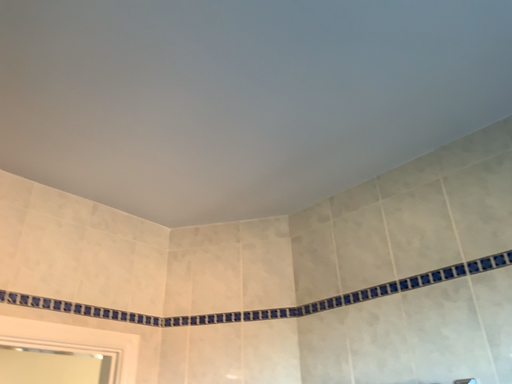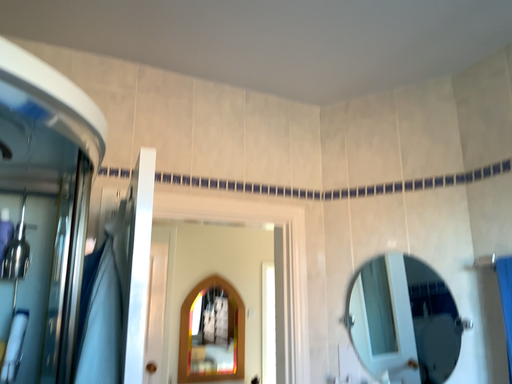
Question: Which way did the camera rotate in the video?

Choices:
 (A) rotated right
 (B) rotated left

Answer: (B)